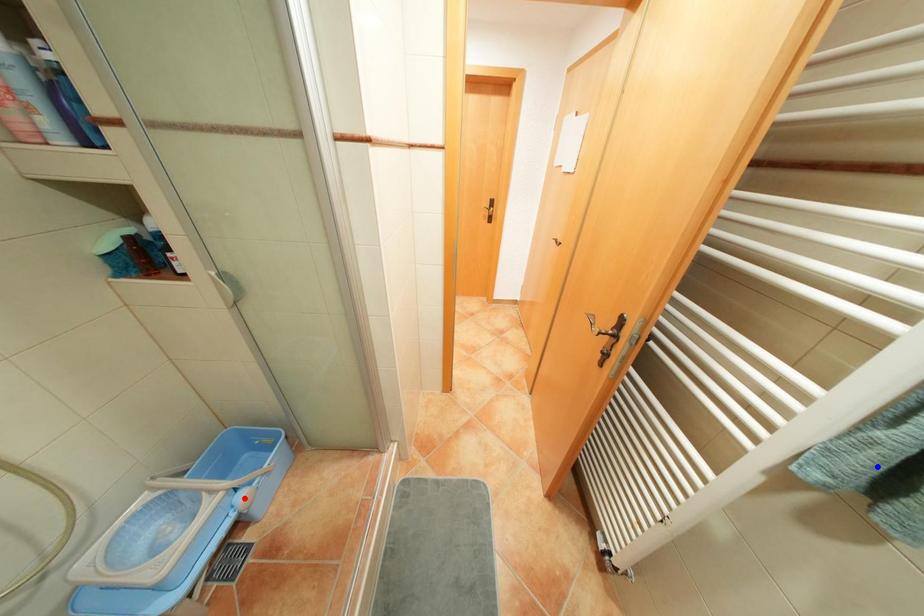
Question: Two points are marked on the image. Which point is closer to the camera?

Choices:
 (A) Blue point is closer.
 (B) Red point is closer.

Answer: (A)